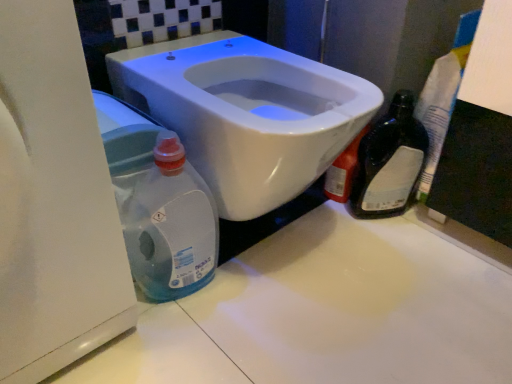
Question: In the image, is black glass bottle at right positioned in front of or behind white glossy counter top at center?

Choices:
 (A) front
 (B) behind

Answer: (B)

Question: From a real-world perspective, is black glass bottle at right positioned above or below white glossy counter top at center?

Choices:
 (A) above
 (B) below

Answer: (A)

Question: Estimate the real-world distances between objects in this image. Which object is closer to the white glossy counter top at center?

Choices:
 (A) black glass bottle at right
 (B) white glossy toilet at center
 (C) translucent plastic bottle at lower left

Answer: (C)

Question: Based on their relative distances, which object is farther from the black glass bottle at right?

Choices:
 (A) translucent plastic bottle at lower left
 (B) white glossy toilet at center
 (C) white glossy counter top at center

Answer: (A)